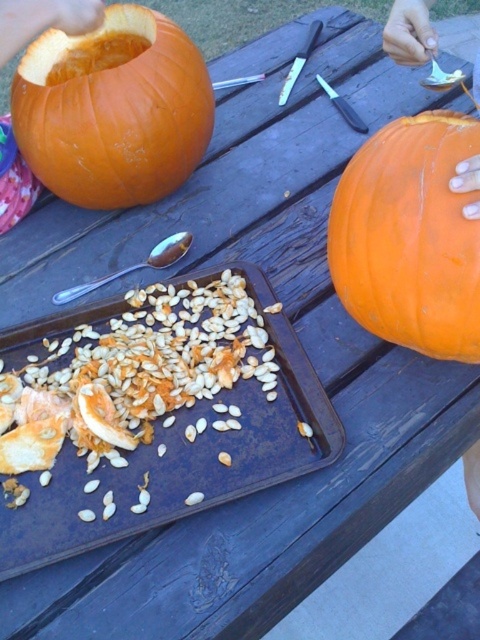
Question: Is orange matte pumpkin at right behind smooth orange pumpkin at upper right?

Choices:
 (A) yes
 (B) no

Answer: (B)

Question: Can you confirm if orange matte pumpkin at upper left is smaller than smooth orange pumpkin at upper right?

Choices:
 (A) yes
 (B) no

Answer: (A)

Question: Estimate the real-world distances between objects in this image. Which object is closer to the orange matte pumpkin at upper left?

Choices:
 (A) metallic baking tray at center
 (B) orange matte pumpkin at right

Answer: (A)

Question: Does metallic baking tray at center have a larger size compared to orange matte pumpkin at upper left?

Choices:
 (A) yes
 (B) no

Answer: (A)

Question: Among these objects, which one is nearest to the camera?

Choices:
 (A) orange matte pumpkin at right
 (B) metallic baking tray at center
 (C) smooth orange pumpkin at upper right
 (D) orange matte pumpkin at upper left

Answer: (A)

Question: Which object is the farthest from the orange matte pumpkin at upper left?

Choices:
 (A) smooth orange pumpkin at upper right
 (B) orange matte pumpkin at right
 (C) metallic baking tray at center

Answer: (A)